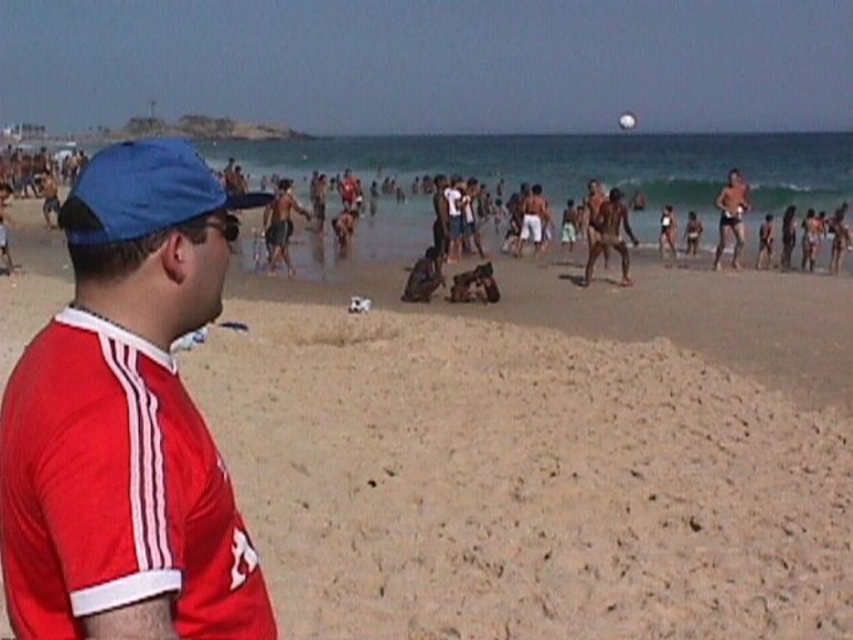
Question: Which object appears closest to the camera in this image?

Choices:
 (A) red matte jersey at left
 (B) smooth tan skin at right
 (C) beige sandy beach at center
 (D) blue fabric baseball cap at left

Answer: (A)

Question: Considering the real-world distances, which object is closest to the beige sandy beach at center?

Choices:
 (A) blue fabric baseball cap at left
 (B) red matte jersey at left

Answer: (A)

Question: Is the position of blue fabric baseball cap at left less distant than that of smooth tan skin at right?

Choices:
 (A) yes
 (B) no

Answer: (A)

Question: Is beige sandy beach at center positioned before red matte jersey at left?

Choices:
 (A) no
 (B) yes

Answer: (A)

Question: Which object is closer to the camera taking this photo?

Choices:
 (A) blue fabric baseball cap at left
 (B) red matte jersey at left

Answer: (B)

Question: Considering the relative positions of red matte jersey at left and smooth tan skin at right in the image provided, where is red matte jersey at left located with respect to smooth tan skin at right?

Choices:
 (A) right
 (B) left

Answer: (B)